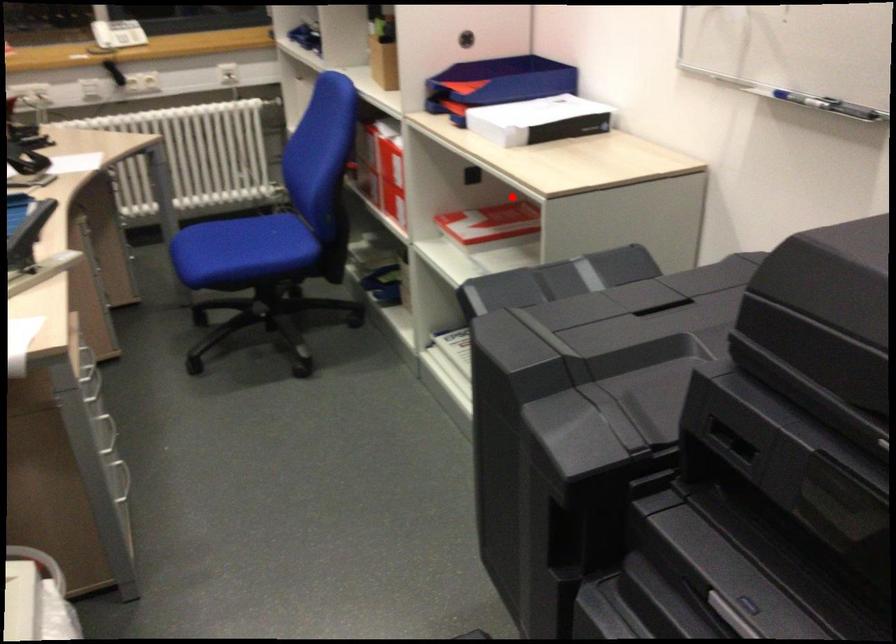
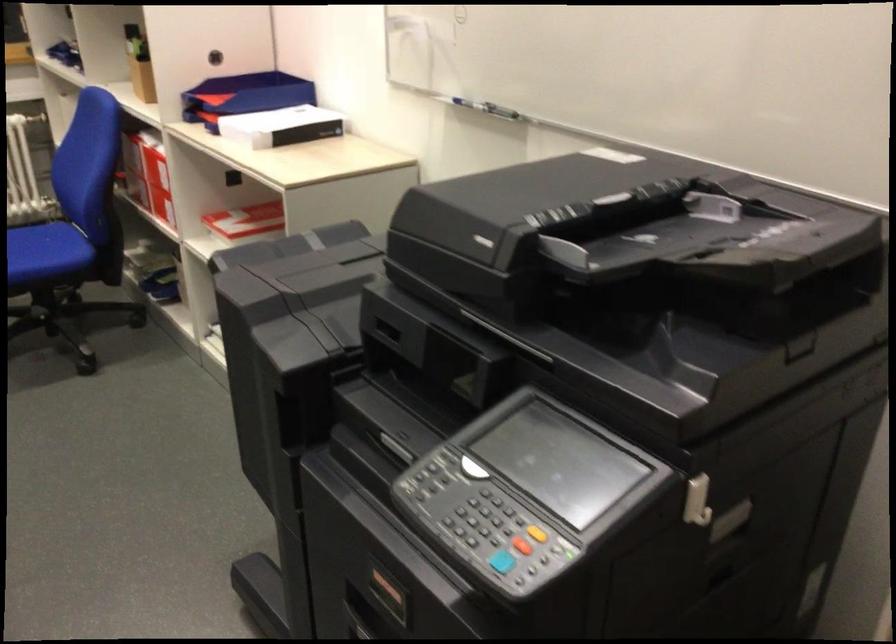
Question: I am providing you with two images of the same scene from different viewpoints. A red point is shown in image1. For the corresponding object point in image2, is it positioned nearer or farther from the camera?

Choices:
 (A) Nearer
 (B) Farther

Answer: (B)